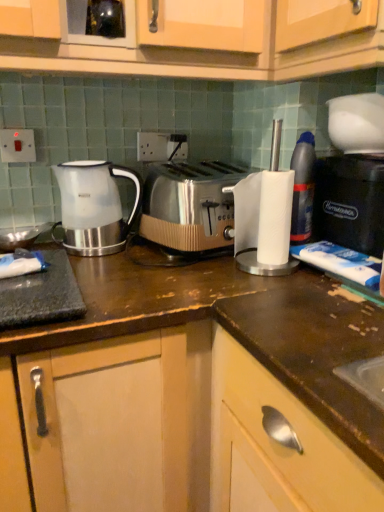
Question: From a real-world perspective, is satin silver toaster at center positioned under translucent plastic bottle at right based on gravity?

Choices:
 (A) yes
 (B) no

Answer: (A)

Question: Is satin silver toaster at center further to the viewer compared to translucent plastic bottle at right?

Choices:
 (A) no
 (B) yes

Answer: (A)

Question: Does satin silver toaster at center have a greater height compared to translucent plastic bottle at right?

Choices:
 (A) no
 (B) yes

Answer: (A)

Question: Is the depth of satin silver toaster at center less than that of translucent plastic bottle at right?

Choices:
 (A) no
 (B) yes

Answer: (B)

Question: From the image's perspective, is satin silver toaster at center beneath translucent plastic bottle at right?

Choices:
 (A) no
 (B) yes

Answer: (B)

Question: From the image's perspective, relative to white plastic electric outlet at upper left, which is counted as the second electric outlet, starting from the back, is translucent plastic bottle at right above or below?

Choices:
 (A) below
 (B) above

Answer: (A)

Question: In the image, is translucent plastic bottle at right positioned in front of or behind white plastic electric outlet at upper left, which is counted as the second electric outlet, starting from the back?

Choices:
 (A) front
 (B) behind

Answer: (A)

Question: Is translucent plastic bottle at right wider or thinner than white plastic electric outlet at upper left, which appears as the 1th electric outlet when viewed from the left?

Choices:
 (A) wide
 (B) thin

Answer: (A)

Question: Considering the relative positions of translucent plastic bottle at right and white plastic electric outlet at upper left, which appears as the 1th electric outlet when viewed from the left, in the image provided, is translucent plastic bottle at right to the left or to the right of white plastic electric outlet at upper left, which appears as the 1th electric outlet when viewed from the left,?

Choices:
 (A) right
 (B) left

Answer: (A)

Question: Considering the relative positions of white plastic electric outlet at center, the 1th electric outlet in the right-to-left sequence, and satin silver toaster at center in the image provided, is white plastic electric outlet at center, the 1th electric outlet in the right-to-left sequence, to the left or to the right of satin silver toaster at center?

Choices:
 (A) left
 (B) right

Answer: (A)

Question: Looking at the image, does white plastic electric outlet at center, acting as the second electric outlet starting from the front, seem bigger or smaller compared to satin silver toaster at center?

Choices:
 (A) small
 (B) big

Answer: (A)

Question: Is point (185, 147) closer or farther from the camera than point (210, 249)?

Choices:
 (A) closer
 (B) farther

Answer: (B)

Question: Relative to satin silver toaster at center, is white plastic electric outlet at center, the 1th electric outlet positioned from the back, in front or behind?

Choices:
 (A) front
 (B) behind

Answer: (B)

Question: Considering the positions of black plastic coffee machine at right and translucent plastic bottle at right in the image, is black plastic coffee machine at right taller or shorter than translucent plastic bottle at right?

Choices:
 (A) short
 (B) tall

Answer: (A)

Question: Does point (345, 147) appear closer or farther from the camera than point (304, 158)?

Choices:
 (A) farther
 (B) closer

Answer: (B)